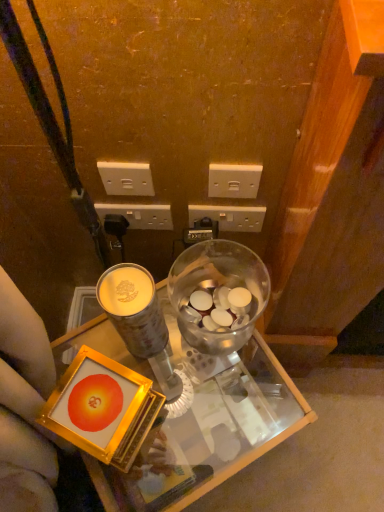
Where is `vacant area on top of transparent glass desk at center (from a real-world perspective)`? The image size is (384, 512). vacant area on top of transparent glass desk at center (from a real-world perspective) is located at coordinates pyautogui.click(x=189, y=404).